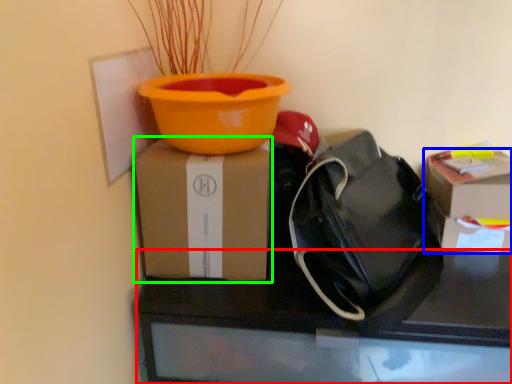
Question: Which object is the closest to the desk (highlighted by a red box)? Choose among these: box (highlighted by a blue box) or box (highlighted by a green box).

Choices:
 (A) box
 (B) box

Answer: (B)